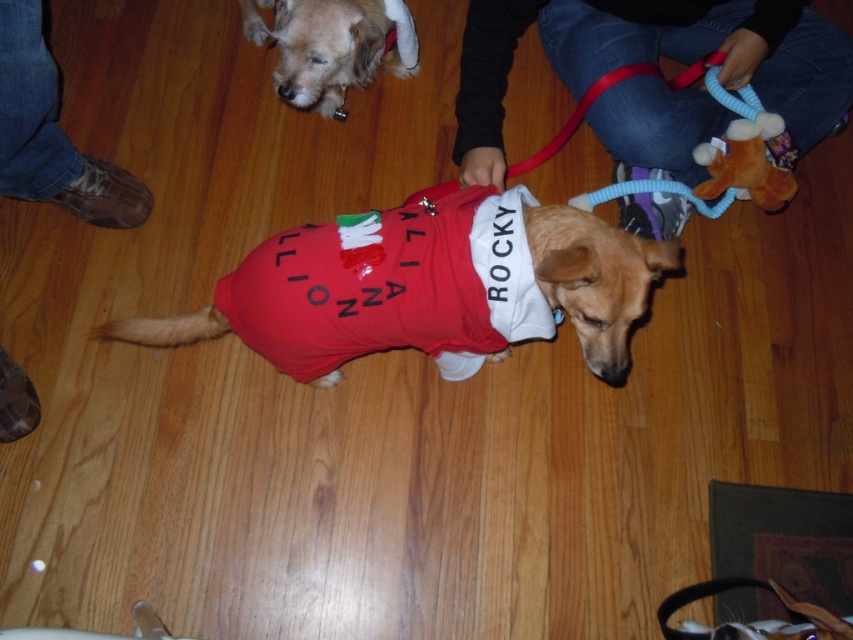
Question: Estimate the real-world distances between objects in this image. Which object is closer to the jeans at center?

Choices:
 (A) brown leather boot at lower left
 (B) shiny red fabric dog at center
 (C) light brown fur at upper center

Answer: (C)

Question: Which object is closer to the camera taking this photo?

Choices:
 (A) brown leather boot at lower left
 (B) light brown fur at upper center
 (C) jeans at center
 (D) shiny red fabric dog at center

Answer: (D)

Question: Where is jeans at center located in relation to brown leather boot at lower left in the image?

Choices:
 (A) right
 (B) left

Answer: (A)

Question: Which object appears closest to the camera in this image?

Choices:
 (A) jeans at center
 (B) shiny brown fur at center
 (C) light brown fur at upper center

Answer: (B)

Question: Can you confirm if brown leather boot at lower left is positioned above light brown fur at upper center?

Choices:
 (A) yes
 (B) no

Answer: (B)

Question: Is brown leather boot at lower left bigger than light brown fur at upper center?

Choices:
 (A) no
 (B) yes

Answer: (B)